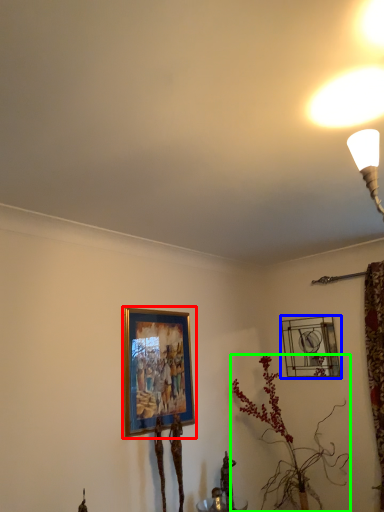
Question: Which object is the farthest from picture frame (highlighted by a red box)? Choose among these: picture frame (highlighted by a blue box) or houseplant (highlighted by a green box).

Choices:
 (A) picture frame
 (B) houseplant

Answer: (A)